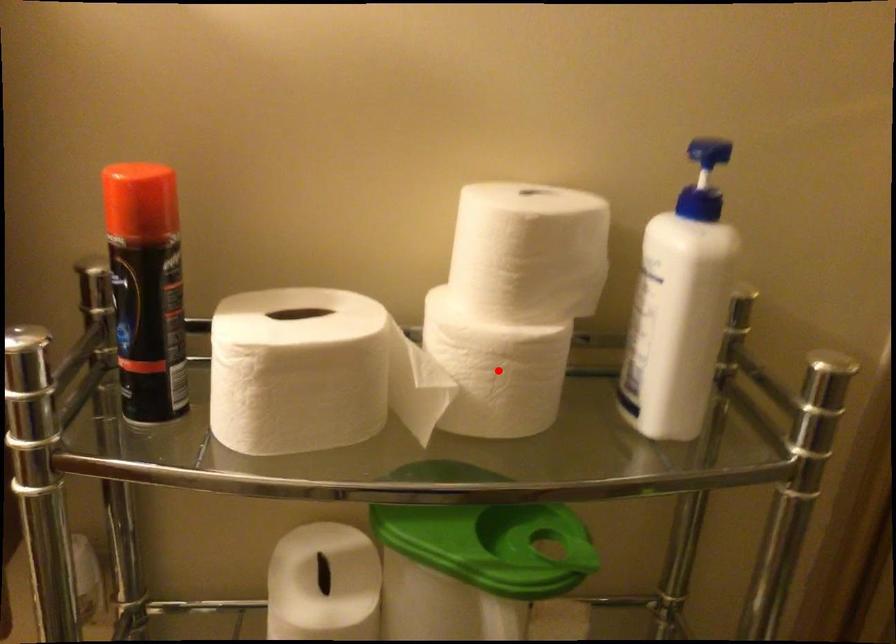
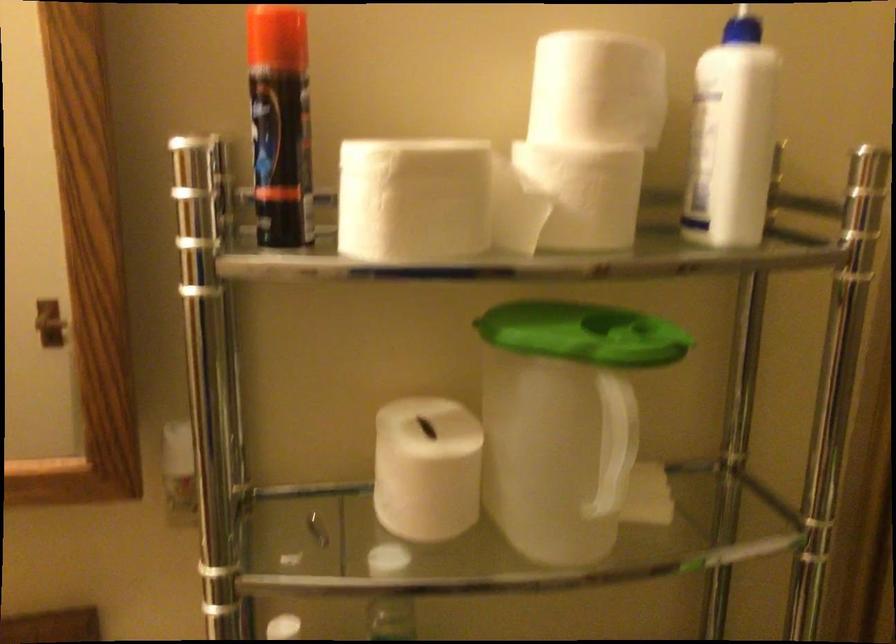
Question: I am providing you with two images of the same scene from different viewpoints. Image1 has a red point marked. In image2, the corresponding 3D location appears at what relative position? Reply with the corresponding letter.

Choices:
 (A) Closer
 (B) Farther

Answer: (B)